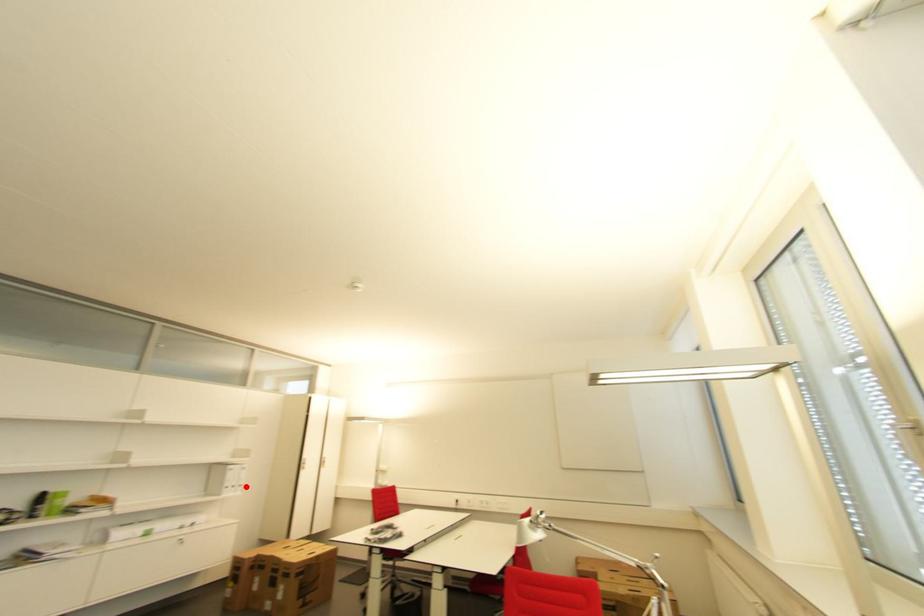
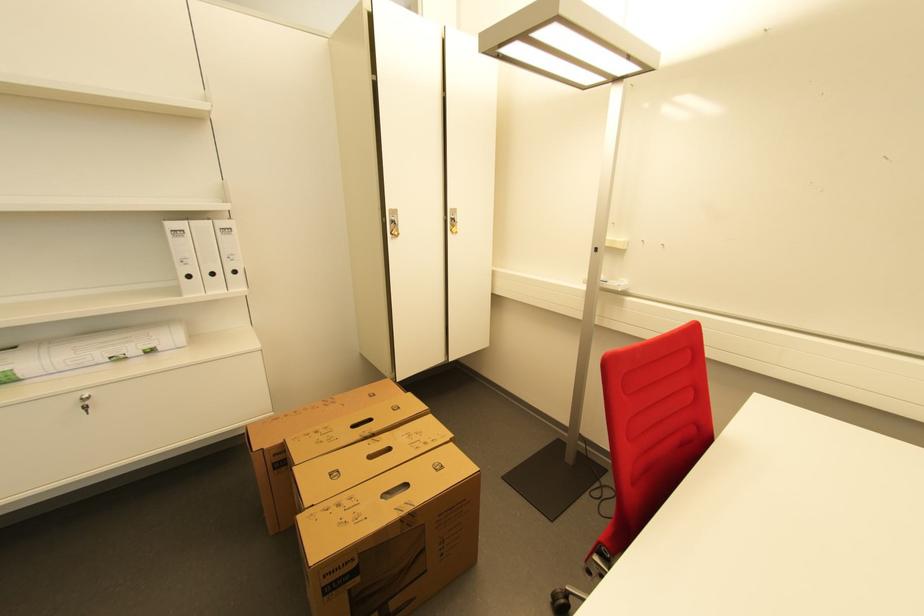
The point at the highlighted location is marked in the first image. Where is the corresponding point in the second image?

(239, 273)